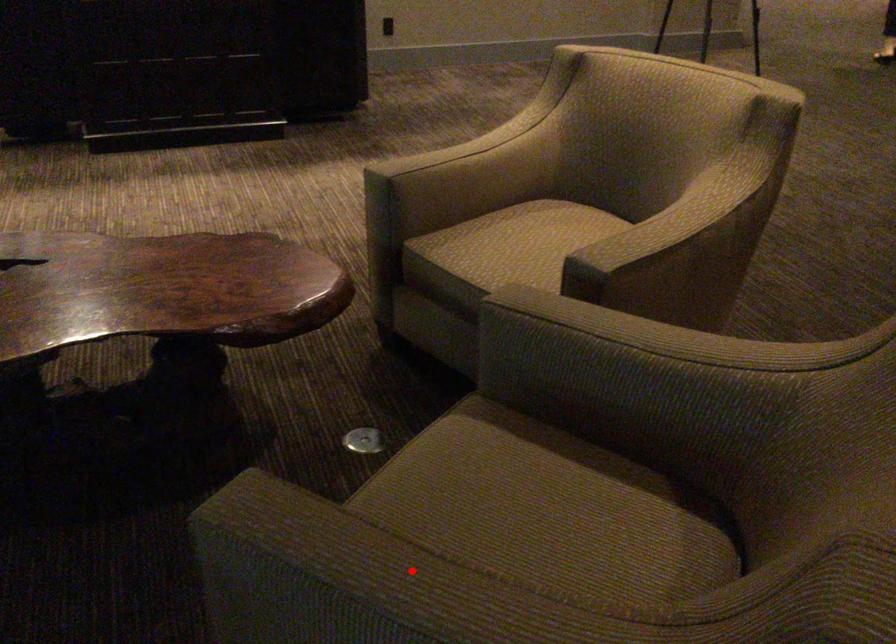
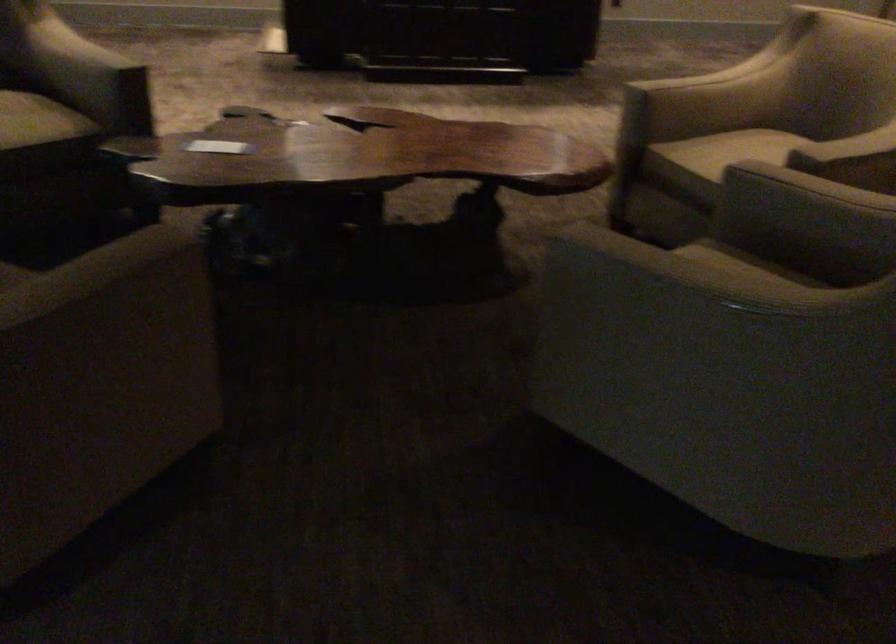
In the second image, find the point that corresponds to the highlighted location in the first image.

(690, 268)